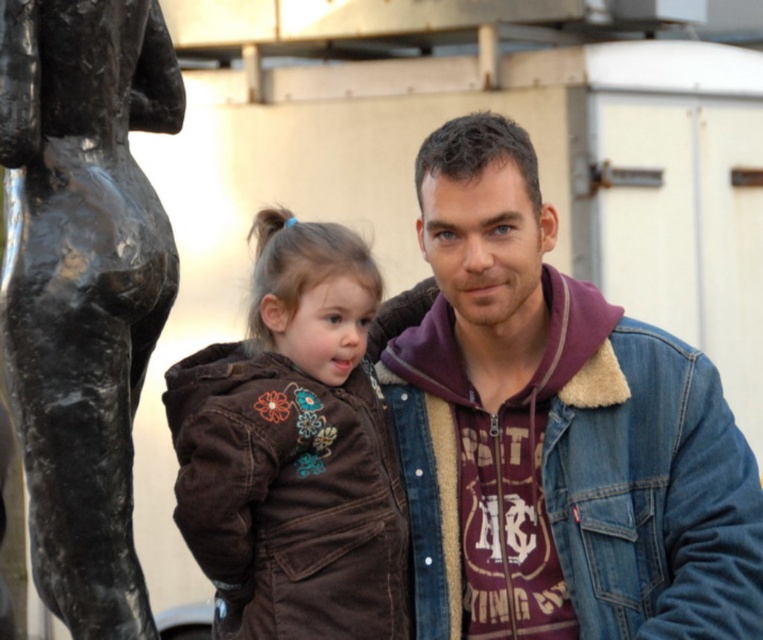
You are a fashion designer observing the two jackets in the scene. Which jacket has a greater width between the denim jacket at right and the brown corduroy jacket at center?

The denim jacket at right has a greater width than the brown corduroy jacket at center according to the description.

You are taking a photo of two people standing near a building. You notice two specific points in the image labeled as point 1 at coordinates (549, 616) and point 2 at (101, 362). Which point is closer to the camera?

Point 1 at coordinates (549, 616) is closer to the camera than point 2 at (101, 362).

In the scene shown: You are a photographer trying to capture both the denim jacket at right and the black polished statue at left in a single frame. Based on their positions, which object should you focus on first to ensure both are in the shot?

The denim jacket at right is positioned under the black polished statue at left, so you should focus on the black polished statue at left first to ensure both are in the shot.